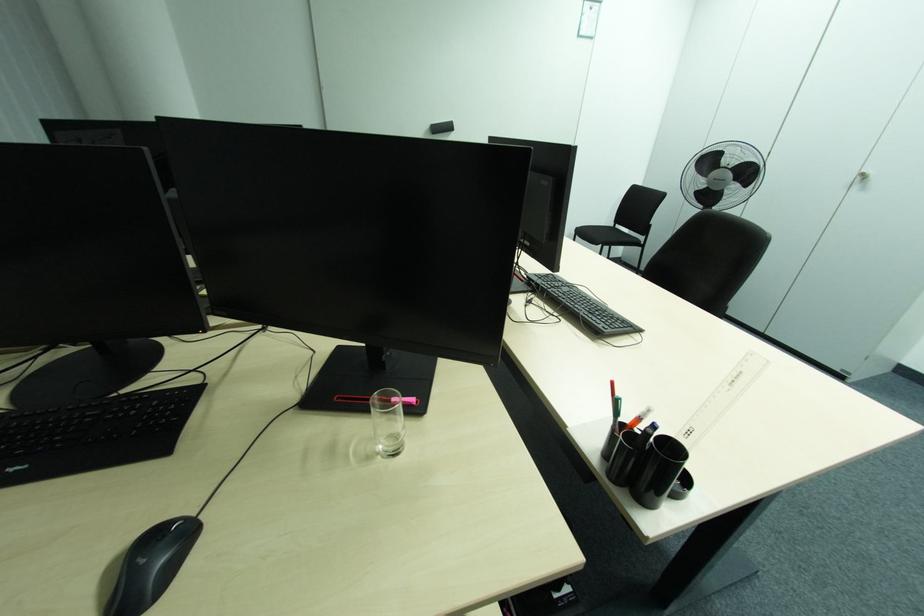
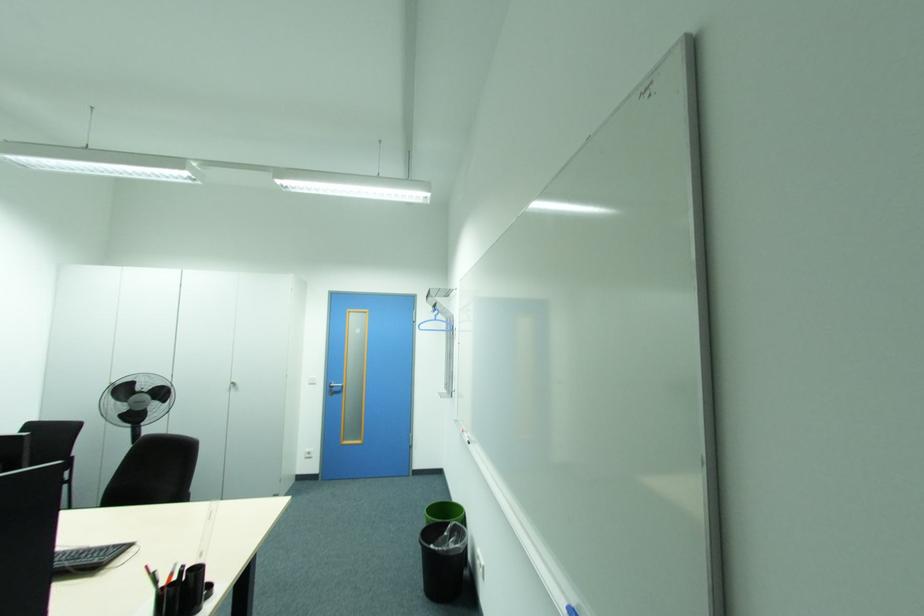
Question: The camera is either moving clockwise (left) or counter-clockwise (right) around the object. The first image is from the beginning of the video and the second image is from the end. Is the camera moving left or right when shooting the video?

Choices:
 (A) Left
 (B) Right

Answer: (A)